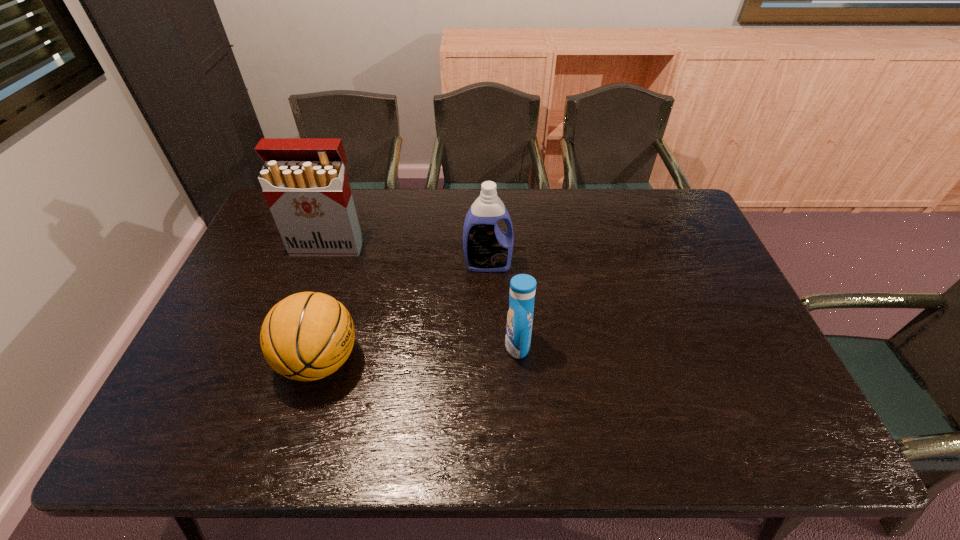
You are a GUI agent. You are given a task and a screenshot of the screen. Output one action in this format:
    pyautogui.click(x=<x>, y=<y>)
    Task: Click on the vacant space situated 0.280m on the surface of the basketball near the brand logo
    
    Given the screenshot: What is the action you would take?
    pyautogui.click(x=472, y=361)

In order to click on object that is at the left edge in this screenshot , I will do `click(304, 180)`.

The image size is (960, 540). In the image, there is a desktop. In order to click on free space at the far edge in this screenshot , I will do `click(547, 202)`.

At what (x,y) coordinates should I click in order to perform the action: click on free space at the near edge of the desktop. Please return your answer as a coordinate pair (x, y). Looking at the image, I should click on (609, 428).

Identify the location of vacant space at the left edge of the desktop. (252, 296).

This screenshot has width=960, height=540. Identify the location of blank area at the right edge. (735, 397).

I want to click on vacant space at the far right corner of the desktop, so click(x=679, y=207).

The image size is (960, 540). I want to click on empty space between the nearer detergent and the taller detergent, so click(x=503, y=305).

Where is `free spot between the farther detergent and the tallest object`? The image size is (960, 540). free spot between the farther detergent and the tallest object is located at coordinates (408, 255).

Image resolution: width=960 pixels, height=540 pixels. I want to click on vacant point located between the second tallest object and the shorter detergent, so click(x=503, y=305).